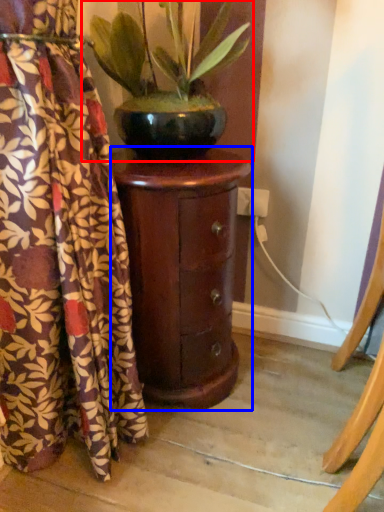
Question: Which object appears farthest to the camera in this image, houseplant (highlighted by a red box) or furniture (highlighted by a blue box)?

Choices:
 (A) houseplant
 (B) furniture

Answer: (B)